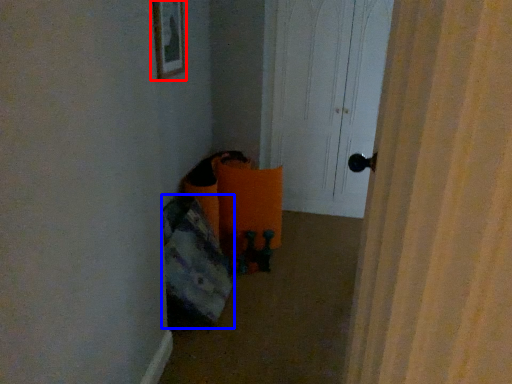
Question: Among these objects, which one is nearest to the camera, picture frame (highlighted by a red box) or bean bag chair (highlighted by a blue box)?

Choices:
 (A) picture frame
 (B) bean bag chair

Answer: (B)